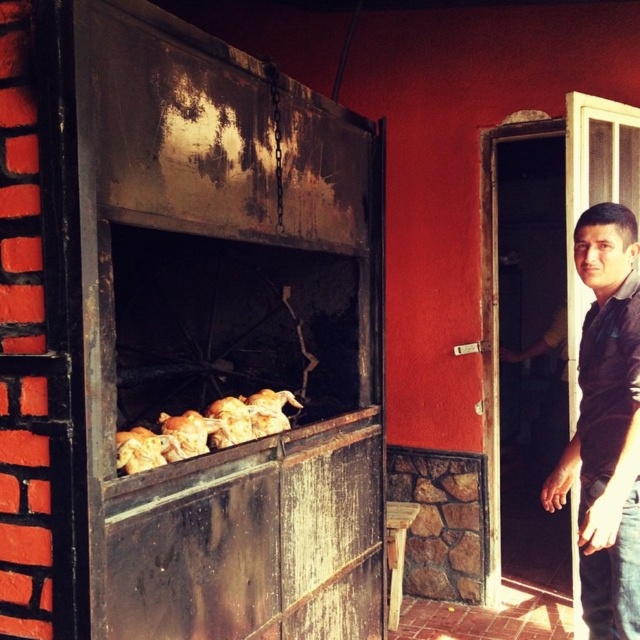
You are a chef preparing to serve a meal and need to choose the tallest chicken from the grill. Which one should you select between the golden brown crispy chicken at center and the golden crispy chicken at center?

The golden brown crispy chicken at center is taller than the golden crispy chicken at center, so you should select the golden brown crispy chicken at center.